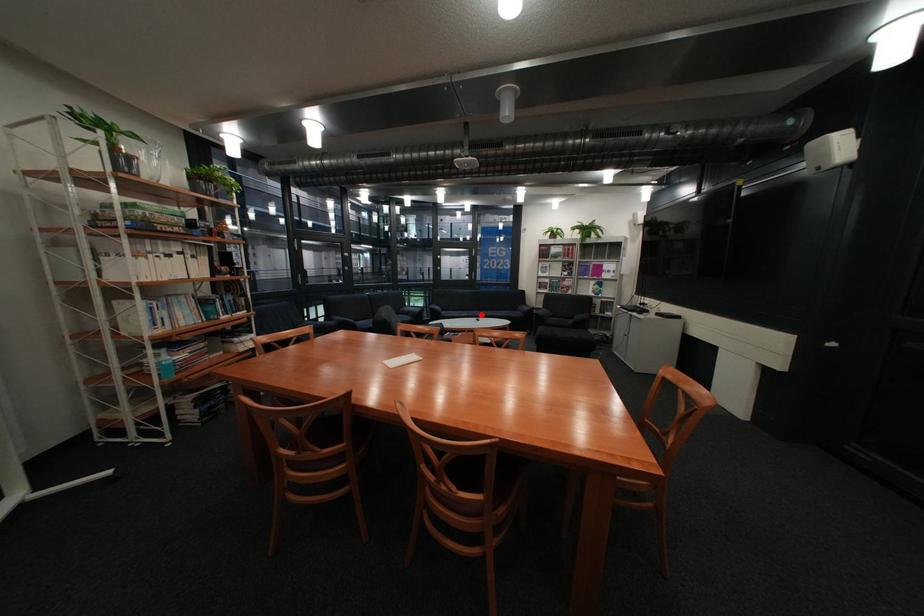
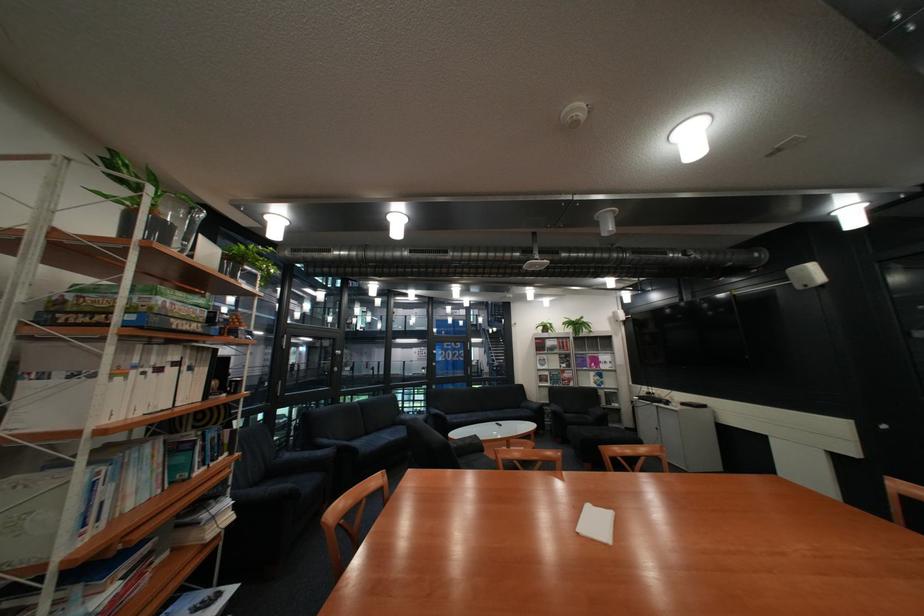
The point at the highlighted location is marked in the first image. Where is the corresponding point in the second image?

(490, 418)